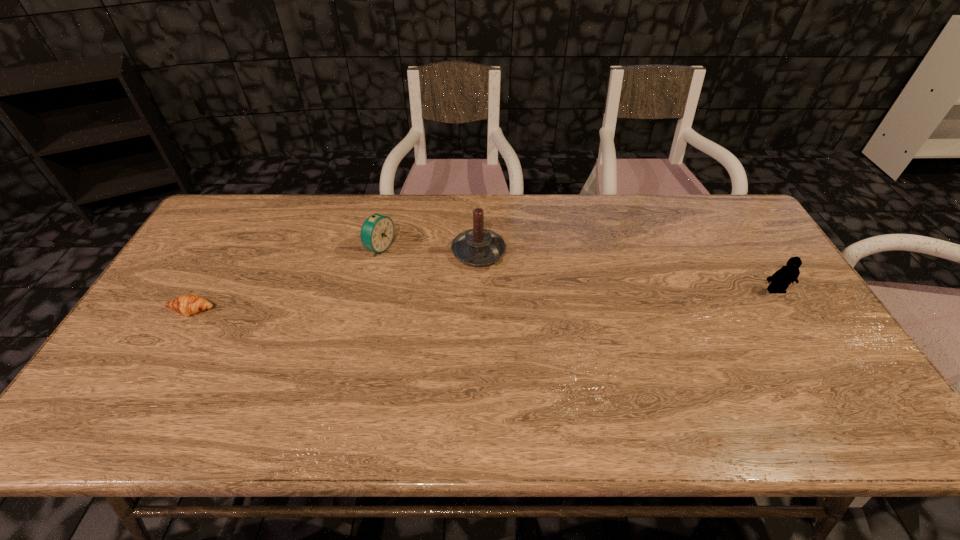
The height and width of the screenshot is (540, 960). Find the location of `free spot on the desktop that is between the leftmost object and the Lego and is positioned on the side of the third object from left to right with the handle loop`. free spot on the desktop that is between the leftmost object and the Lego and is positioned on the side of the third object from left to right with the handle loop is located at coordinates (521, 299).

What are the coordinates of `vacant space on the desktop that is between the pastry and the rightmost object and is positioned on the front-facing side of the second object from left to right` in the screenshot? It's located at (512, 299).